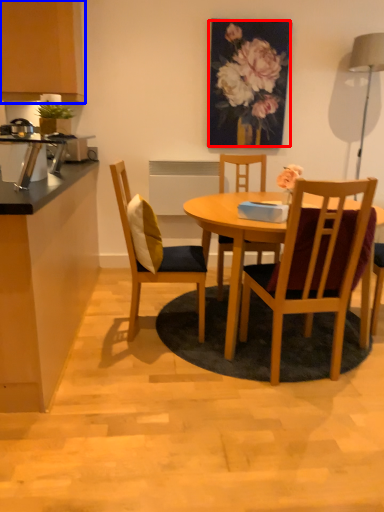
Question: Which object appears farthest to the camera in this image, floral arrangement (highlighted by a red box) or cabinetry (highlighted by a blue box)?

Choices:
 (A) floral arrangement
 (B) cabinetry

Answer: (A)